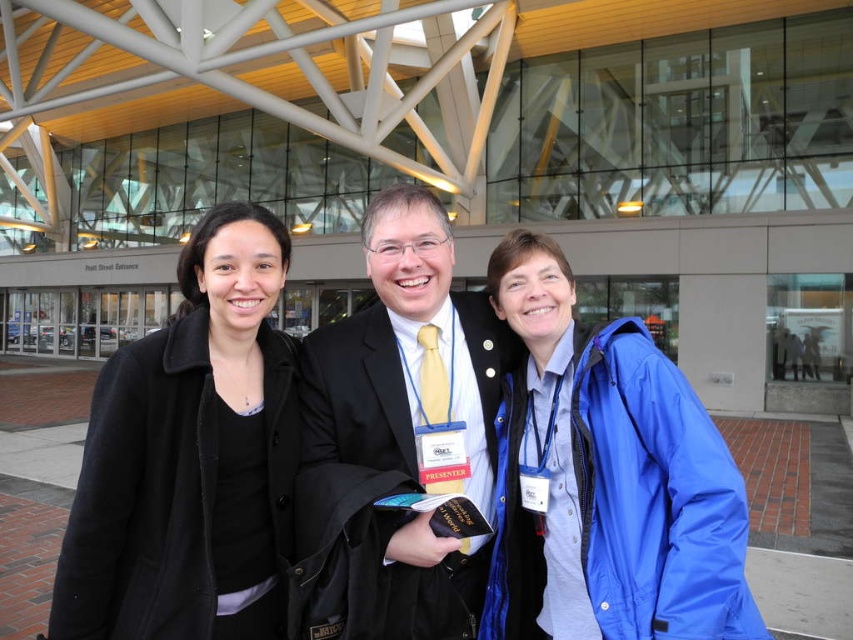
This screenshot has height=640, width=853. What do you see at coordinates (190, 458) in the screenshot?
I see `black matte coat at left` at bounding box center [190, 458].

The image size is (853, 640). What are the coordinates of `black matte coat at left` in the screenshot? It's located at (190, 458).

Does black matte coat at left appear on the right side of matte black suit at center?

Incorrect, black matte coat at left is not on the right side of matte black suit at center.

Image resolution: width=853 pixels, height=640 pixels. What do you see at coordinates (190, 458) in the screenshot?
I see `black matte coat at left` at bounding box center [190, 458].

Where is `black matte coat at left`? black matte coat at left is located at coordinates (190, 458).

Who is positioned more to the right, blue matte jacket at right or matte black suit at center?

From the viewer's perspective, blue matte jacket at right appears more on the right side.

Is the position of blue matte jacket at right more distant than that of matte black suit at center?

No, it is in front of matte black suit at center.

Where is `blue matte jacket at right`? The height and width of the screenshot is (640, 853). blue matte jacket at right is located at coordinates point(606,477).